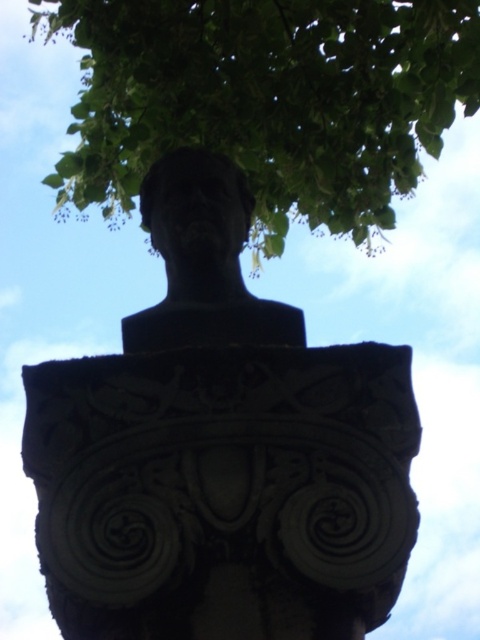
Does point (321, 572) come closer to viewer compared to point (136, 346)?

Yes, point (321, 572) is closer to viewer.

Between black stone bust at center and black stone bust at upper center, which one has more height?

Standing taller between the two is black stone bust at center.

Between point (403, 376) and point (195, 275), which one is positioned in front?

Positioned in front is point (403, 376).

In order to click on black stone bust at center in this screenshot , I will do `click(219, 451)`.

Which is below, black stone bust at center or green leafy tree at upper center?

Positioned lower is black stone bust at center.

Which is in front, point (309, 598) or point (284, 102)?

Point (309, 598) is in front.

Locate an element on the screen. This screenshot has width=480, height=640. black stone bust at center is located at coordinates (219, 451).

Can you confirm if green leafy tree at upper center is positioned below black stone bust at upper center?

Actually, green leafy tree at upper center is above black stone bust at upper center.

Is green leafy tree at upper center further to the viewer compared to black stone bust at upper center?

Yes, green leafy tree at upper center is further from the viewer.

The width and height of the screenshot is (480, 640). Describe the element at coordinates (266, 99) in the screenshot. I see `green leafy tree at upper center` at that location.

Locate an element on the screen. green leafy tree at upper center is located at coordinates (266, 99).